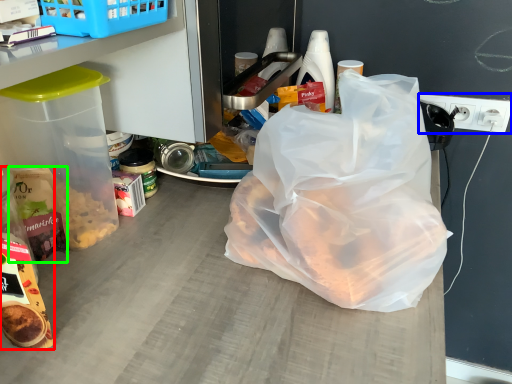
Question: Based on their relative distances, which object is nearer to snack (highlighted by a red box)? Choose from electric outlet (highlighted by a blue box) and cereal (highlighted by a green box).

Choices:
 (A) electric outlet
 (B) cereal

Answer: (B)